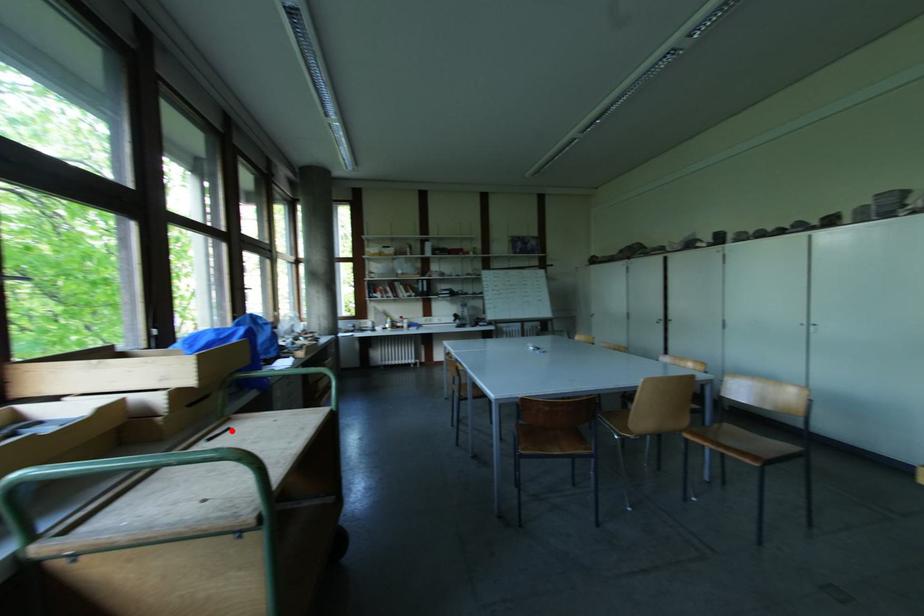
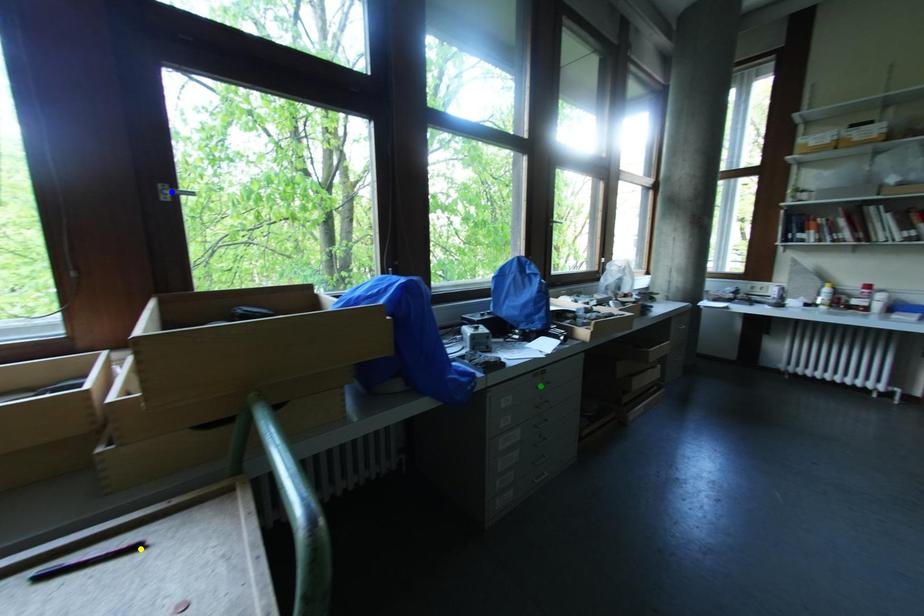
Question: I am providing you with two images of the same scene from different viewpoints. A red point is marked on the first image. You are given multiple points on the second image. Which mark in image 2 goes with the point in image 1?

Choices:
 (A) green point
 (B) yellow point
 (C) blue point

Answer: (B)